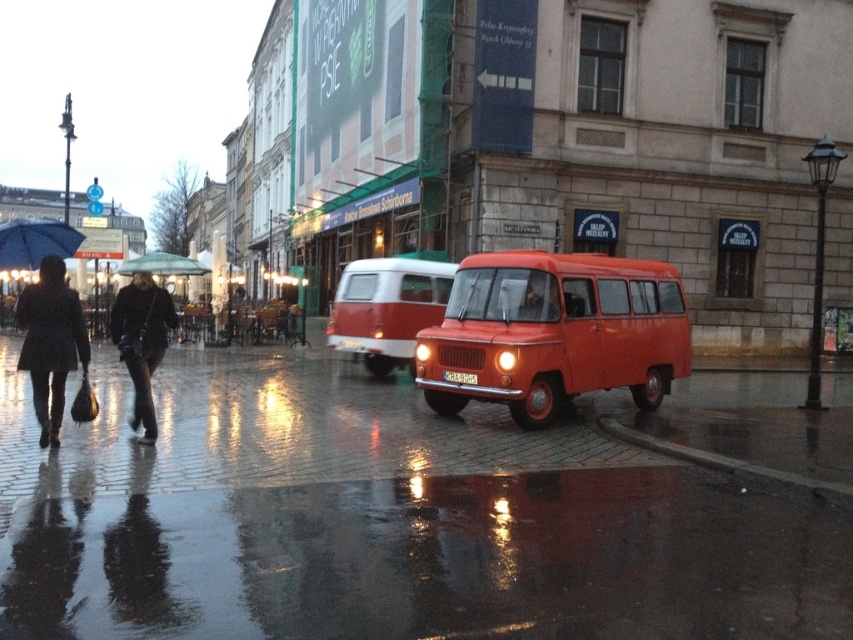
Who is higher up, glossy brick pavement at center or matte red van at center?

Positioned higher is matte red van at center.

In the scene shown: Is glossy brick pavement at center further to the viewer compared to matte red van at center?

No, glossy brick pavement at center is closer to the viewer.

Is point (824, 636) farther from camera compared to point (347, 317)?

That is False.

Identify the location of glossy brick pavement at center. The height and width of the screenshot is (640, 853). (384, 520).

Between matte orange van at center and matte black coat at left, which one is positioned higher?

matte black coat at left is higher up.

Can you confirm if matte orange van at center is smaller than matte black coat at left?

Yes.

This screenshot has height=640, width=853. Describe the element at coordinates (554, 332) in the screenshot. I see `matte orange van at center` at that location.

Locate an element on the screen. The height and width of the screenshot is (640, 853). matte orange van at center is located at coordinates (554, 332).

Between dark gray fabric coat at lower left and blue matte umbrella at left, which one is positioned lower?

dark gray fabric coat at lower left

Between dark gray fabric coat at lower left and blue matte umbrella at left, which one appears on the left side from the viewer's perspective?

From the viewer's perspective, blue matte umbrella at left appears more on the left side.

Between point (154, 429) and point (62, 250), which one is positioned in front?

Positioned in front is point (154, 429).

The image size is (853, 640). I want to click on dark gray fabric coat at lower left, so click(x=141, y=340).